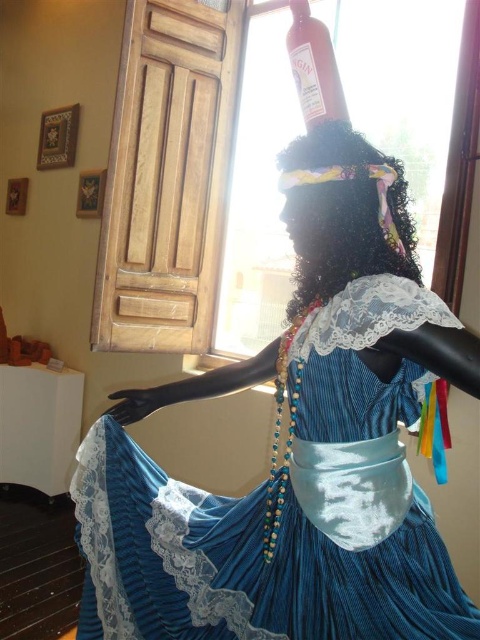
You are a fashion designer who wants to place a new accessory on the blue velvet dress at center. However, there is a matte glass bottle at upper center in the way. Can you place the accessory on the dress without moving the bottle?

The blue velvet dress at center is below the matte glass bottle at upper center, so you can place the accessory on the dress since it is positioned lower and not obstructed by the bottle.

You are a photographer trying to capture a closeup of the blue velvet dress at center. Your camera has a minimum focusing distance of 36 inches. Can you take the photo without moving the dress or the camera?

The blue velvet dress at center and camera are 35.82 inches apart from each other, so yes, you can take the photo without moving the dress or the camera because the distance is within the camera minimum focusing distance of 36 inches.